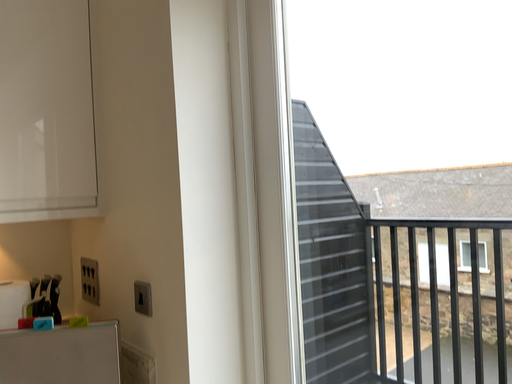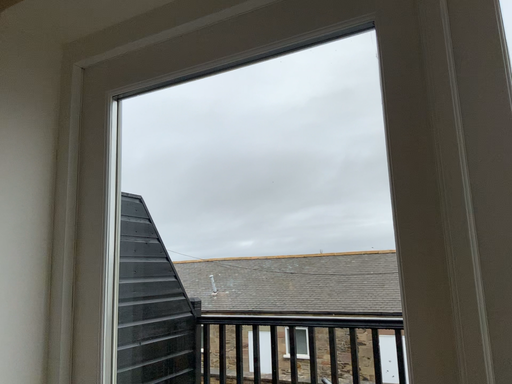
Question: How did the camera likely rotate when shooting the video?

Choices:
 (A) rotated right
 (B) rotated left

Answer: (A)